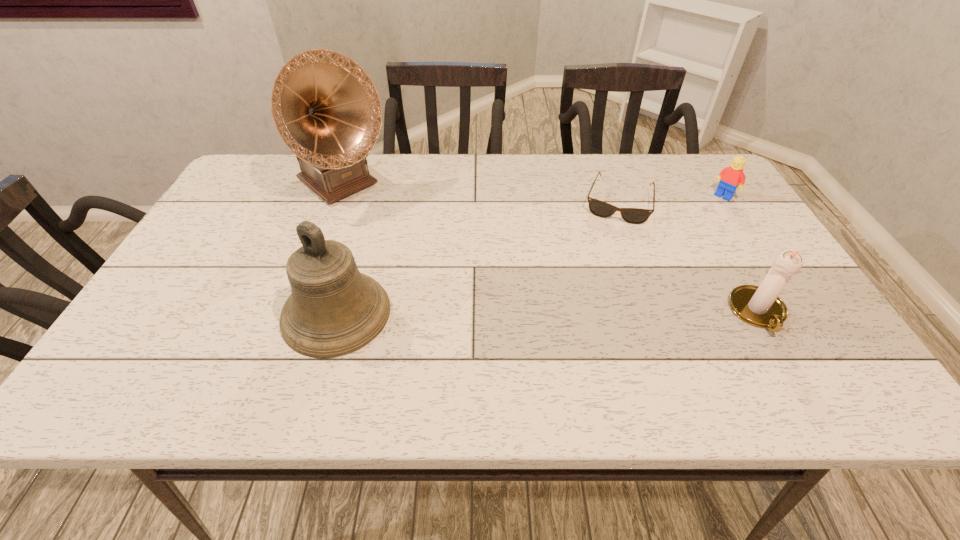
Locate an element on the screen. Image resolution: width=960 pixels, height=540 pixels. object identified as the closest to the bell is located at coordinates (325, 107).

Where is `object that is the closest to the fourth shortest object`? object that is the closest to the fourth shortest object is located at coordinates (325, 107).

Where is `free location that satisfies the following two spatial constraints: 1. on the back side of the Lego; 2. on the left side of the shortest object`? This screenshot has width=960, height=540. free location that satisfies the following two spatial constraints: 1. on the back side of the Lego; 2. on the left side of the shortest object is located at coordinates (615, 196).

Find the location of a particular element. The width and height of the screenshot is (960, 540). vacant area that satisfies the following two spatial constraints: 1. on the back side of the Lego; 2. on the left side of the second tallest object is located at coordinates (371, 196).

Identify the location of vacant space that satisfies the following two spatial constraints: 1. on the front side of the shortest object; 2. on the right side of the tallest object. (336, 202).

Locate an element on the screen. This screenshot has width=960, height=540. vacant space that satisfies the following two spatial constraints: 1. on the back side of the rightmost object; 2. on the right side of the third object from left to right is located at coordinates (615, 196).